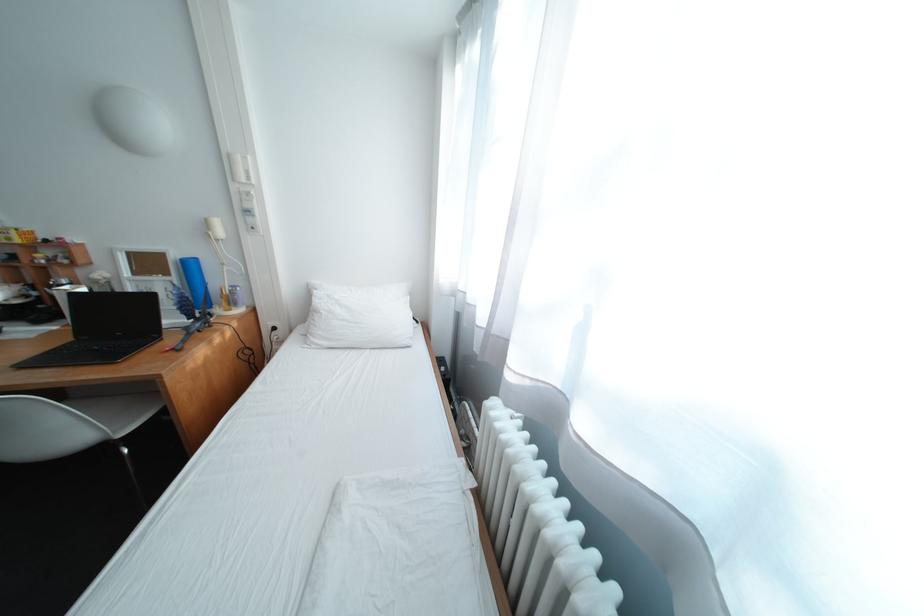
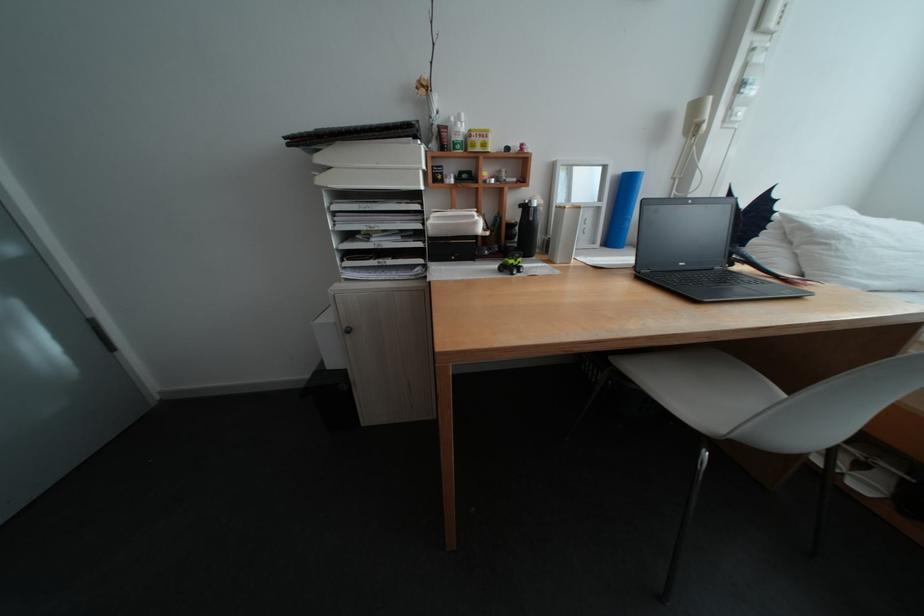
Where in the second image is the point corresponding to [130,334] from the first image?

(694, 265)